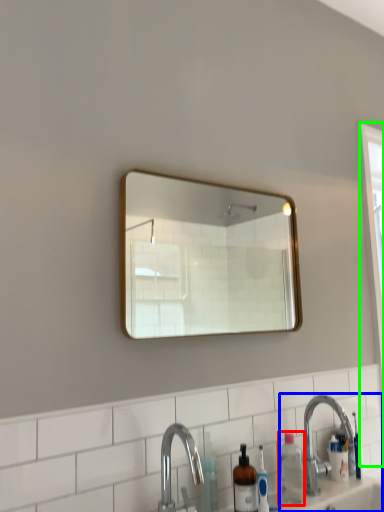
Question: Based on their relative distances, which object is nearer to bottle (highlighted by a red box)? Choose from sink (highlighted by a blue box) and screen door (highlighted by a green box).

Choices:
 (A) sink
 (B) screen door

Answer: (A)